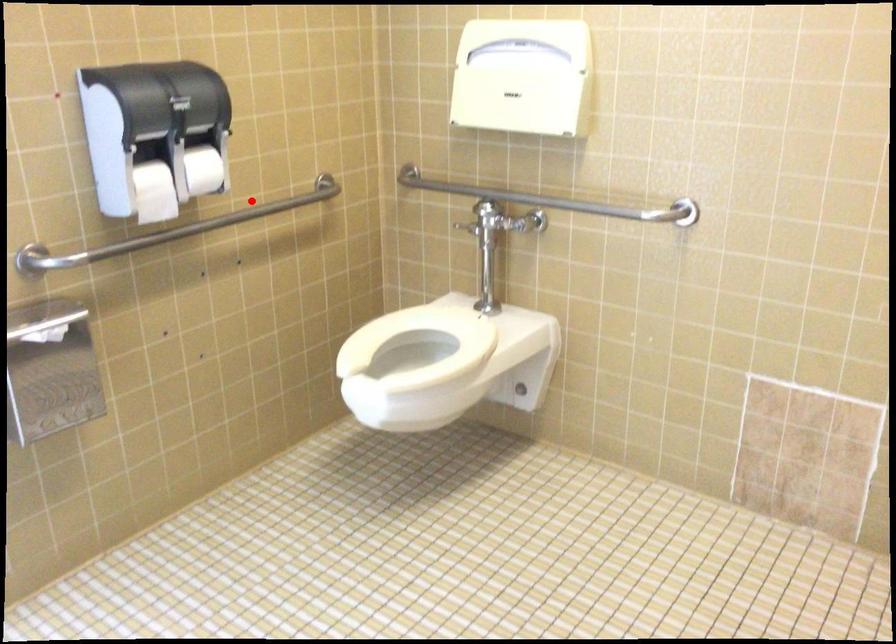
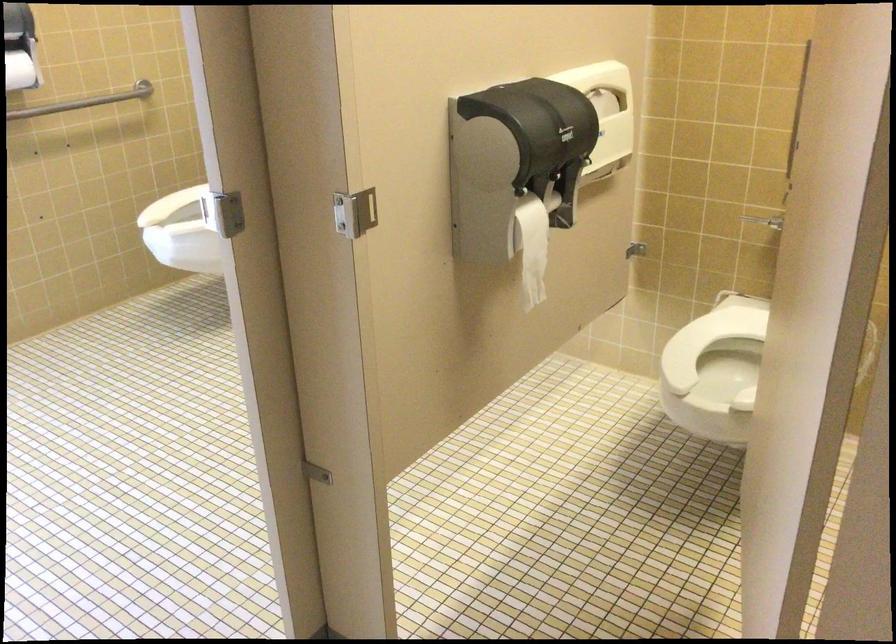
Question: I am providing you with two images of the same scene from different viewpoints. Image1 has a red point marked. In image2, the corresponding 3D location appears at what relative position? Reply with the corresponding letter.

Choices:
 (A) Closer
 (B) Farther

Answer: (B)